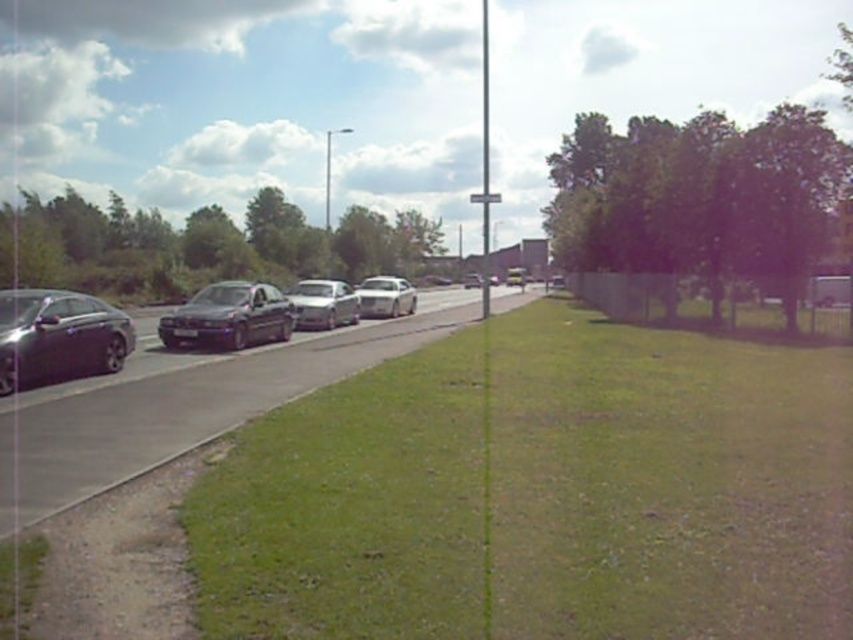
Does satin black sedan at center have a lesser height compared to white glossy car at center?

Yes.

This screenshot has width=853, height=640. Describe the element at coordinates (229, 316) in the screenshot. I see `satin black sedan at center` at that location.

At what (x,y) coordinates should I click in order to perform the action: click on satin black sedan at center. Please return your answer as a coordinate pair (x, y). Looking at the image, I should click on (229, 316).

Is satin black sedan at center shorter than shiny silver sedan at center?

Correct, satin black sedan at center is not as tall as shiny silver sedan at center.

Where is `satin black sedan at center`? This screenshot has height=640, width=853. satin black sedan at center is located at coordinates (229, 316).

Consider the image. Who is more forward, (283, 305) or (523, 269)?

Point (283, 305) is more forward.

This screenshot has height=640, width=853. Find the location of `satin black sedan at center`. satin black sedan at center is located at coordinates (229, 316).

Is point (67, 305) farther from camera compared to point (173, 336)?

That is False.

Does shiny black sedan at left have a smaller size compared to satin black sedan at center?

Indeed, shiny black sedan at left has a smaller size compared to satin black sedan at center.

Between point (15, 304) and point (263, 328), which one is positioned behind?

Point (263, 328)

This screenshot has height=640, width=853. In order to click on shiny black sedan at left in this screenshot , I will do `click(57, 337)`.